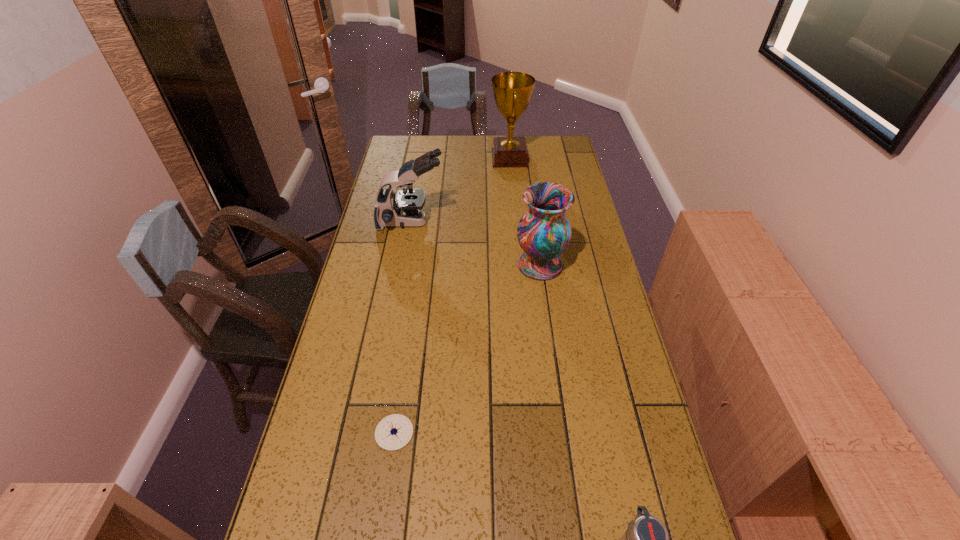
At what (x,y) coordinates should I click in order to perform the action: click on free spot located 0.400m on the front of the third farthest object. Please return your answer as a coordinate pair (x, y). The height and width of the screenshot is (540, 960). Looking at the image, I should click on (558, 393).

This screenshot has width=960, height=540. Find the location of `blank space located 0.240m on the right of the second nearest object`. blank space located 0.240m on the right of the second nearest object is located at coordinates (512, 433).

I want to click on object present at the far edge, so click(512, 91).

Locate an element on the screen. This screenshot has height=540, width=960. object located at the left edge is located at coordinates (404, 208).

At what (x,y) coordinates should I click in order to perform the action: click on object located in the right edge section of the desktop. Please return your answer as a coordinate pair (x, y). Looking at the image, I should click on (544, 232).

You are a GUI agent. You are given a task and a screenshot of the screen. Output one action in this format:
    pyautogui.click(x=<x>, y=<y>)
    Task: Click on the vacant space at the left edge
    The height and width of the screenshot is (540, 960).
    Given the screenshot: What is the action you would take?
    pos(314,420)

This screenshot has width=960, height=540. In the image, there is a desktop. Find the location of `vacant region at the right edge`. vacant region at the right edge is located at coordinates (630, 355).

Locate an element on the screen. Image resolution: width=960 pixels, height=540 pixels. vacant space at the far left corner of the desktop is located at coordinates tap(389, 152).

This screenshot has width=960, height=540. Find the location of `free location at the far right corner`. free location at the far right corner is located at coordinates (560, 148).

Where is `vacant space that's between the second nearest object and the vase`? This screenshot has height=540, width=960. vacant space that's between the second nearest object and the vase is located at coordinates pyautogui.click(x=468, y=349).